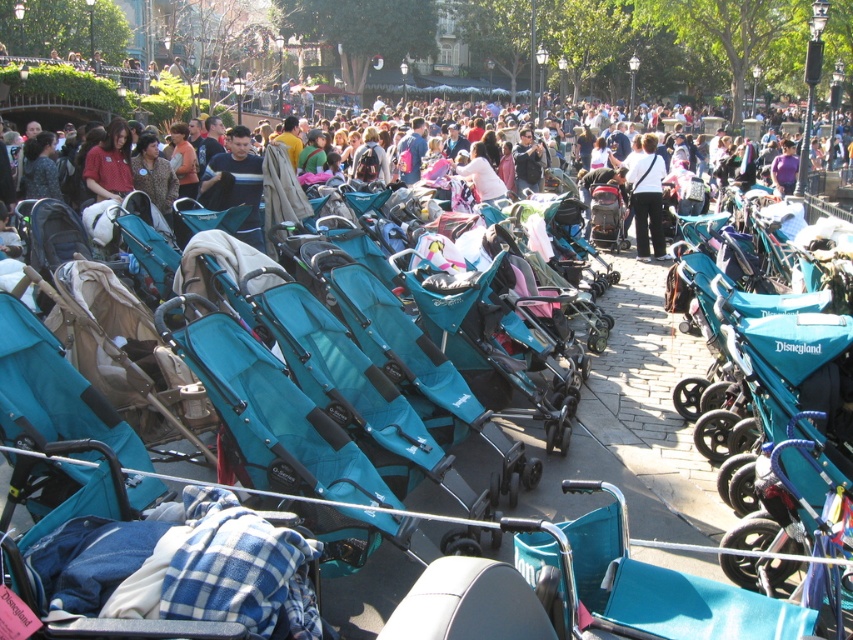
You are a park maintenance worker who needs to move a teal fabric stroller at center to a storage area located 30 feet away from teal strollers at center. Can you safely move it without exceeding the distance limit?

The distance between the teal fabric stroller at center and teal strollers at center is 30.18 feet, which is slightly over the 30 feet limit. Therefore, moving the teal fabric stroller at center to the storage area would exceed the allowed distance.

You are a parent looking for a stroller in the teal fabric stroller at center and the teal strollers at center. Which one is more to the left?

The teal fabric stroller at center is positioned on the left side of teal strollers at center, so the teal fabric stroller at center is more to the left.

You are standing at the point closest to the lampposts in the background. There are two points of interest in the scene marked as point 1 at coordinates point (654,228) and point 2 at coordinates point (102,140). Which point is farther away from you?

Point (654,228) is behind point (102,140), so point (654,228) is farther away from you.